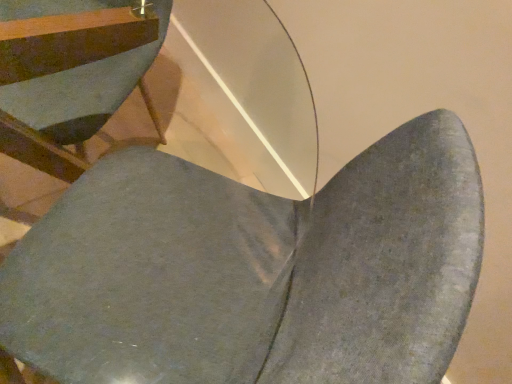
What do you see at coordinates (254, 271) in the screenshot?
I see `matte gray chair at center, which is the first chair in right-to-left order` at bounding box center [254, 271].

What is the approximate width of matte gray chair at center, which is the first chair in right-to-left order?

The width of matte gray chair at center, which is the first chair in right-to-left order, is 22.30 inches.

Find the location of a particular element. This screenshot has width=512, height=384. matte gray chair at center, marked as the second chair in a left-to-right arrangement is located at coordinates (254, 271).

Image resolution: width=512 pixels, height=384 pixels. Describe the element at coordinates (72, 76) in the screenshot. I see `matte gray chair at lower left, the first chair positioned from the left` at that location.

Locate an element on the screen. This screenshot has height=384, width=512. matte gray chair at lower left, arranged as the second chair when viewed from the right is located at coordinates (72, 76).

This screenshot has height=384, width=512. Identify the location of matte gray chair at center, marked as the second chair in a left-to-right arrangement. (254, 271).

Between matte gray chair at lower left, arranged as the second chair when viewed from the right, and matte gray chair at center, marked as the second chair in a left-to-right arrangement, which one appears on the right side from the viewer's perspective?

From the viewer's perspective, matte gray chair at center, marked as the second chair in a left-to-right arrangement, appears more on the right side.

Is matte gray chair at lower left, the first chair positioned from the left, closer to camera compared to matte gray chair at center, which is the first chair in right-to-left order?

No, it is behind matte gray chair at center, which is the first chair in right-to-left order.

Does point (4, 139) come behind point (411, 226)?

That is True.

From the image's perspective, is matte gray chair at lower left, the first chair positioned from the left, located above matte gray chair at center, marked as the second chair in a left-to-right arrangement?

Yes, from the image's perspective, matte gray chair at lower left, the first chair positioned from the left, is over matte gray chair at center, marked as the second chair in a left-to-right arrangement.

From a real-world perspective, which is physically above, matte gray chair at lower left, arranged as the second chair when viewed from the right, or matte gray chair at center, marked as the second chair in a left-to-right arrangement?

matte gray chair at center, marked as the second chair in a left-to-right arrangement, from a real-world perspective.

Considering the relative sizes of matte gray chair at lower left, arranged as the second chair when viewed from the right, and matte gray chair at center, marked as the second chair in a left-to-right arrangement, in the image provided, is matte gray chair at lower left, arranged as the second chair when viewed from the right, thinner than matte gray chair at center, marked as the second chair in a left-to-right arrangement,?

In fact, matte gray chair at lower left, arranged as the second chair when viewed from the right, might be wider than matte gray chair at center, marked as the second chair in a left-to-right arrangement.

From their relative heights in the image, would you say matte gray chair at lower left, the first chair positioned from the left, is taller or shorter than matte gray chair at center, which is the first chair in right-to-left order?

In the image, matte gray chair at lower left, the first chair positioned from the left, appears to be shorter than matte gray chair at center, which is the first chair in right-to-left order.

Between matte gray chair at lower left, arranged as the second chair when viewed from the right, and matte gray chair at center, marked as the second chair in a left-to-right arrangement, which one has larger size?

matte gray chair at center, marked as the second chair in a left-to-right arrangement.

Is matte gray chair at lower left, arranged as the second chair when viewed from the right, positioned beyond the bounds of matte gray chair at center, which is the first chair in right-to-left order?

That's correct, matte gray chair at lower left, arranged as the second chair when viewed from the right, is outside of matte gray chair at center, which is the first chair in right-to-left order.

Is matte gray chair at lower left, the first chair positioned from the left, next to matte gray chair at center, marked as the second chair in a left-to-right arrangement?

No, matte gray chair at lower left, the first chair positioned from the left, is not in contact with matte gray chair at center, marked as the second chair in a left-to-right arrangement.

Is matte gray chair at center, marked as the second chair in a left-to-right arrangement, at the back of matte gray chair at lower left, arranged as the second chair when viewed from the right?

No.

The image size is (512, 384). I want to click on chair below the matte gray chair at center, marked as the second chair in a left-to-right arrangement (from a real-world perspective), so click(72, 76).

Is matte gray chair at center, marked as the second chair in a left-to-right arrangement, at the left side of matte gray chair at lower left, the first chair positioned from the left?

Incorrect, matte gray chair at center, marked as the second chair in a left-to-right arrangement, is not on the left side of matte gray chair at lower left, the first chair positioned from the left.

Is the position of matte gray chair at center, marked as the second chair in a left-to-right arrangement, less distant than that of matte gray chair at lower left, the first chair positioned from the left?

That is True.

Between point (180, 161) and point (151, 102), which one is positioned in front?

The point (180, 161) is closer.

From the image's perspective, is matte gray chair at center, marked as the second chair in a left-to-right arrangement, located above or below matte gray chair at lower left, arranged as the second chair when viewed from the right?

From the image's perspective, matte gray chair at center, marked as the second chair in a left-to-right arrangement, appears below matte gray chair at lower left, arranged as the second chair when viewed from the right.

In the scene shown: From a real-world perspective, who is located lower, matte gray chair at center, which is the first chair in right-to-left order, or matte gray chair at lower left, arranged as the second chair when viewed from the right?

Result: matte gray chair at lower left, arranged as the second chair when viewed from the right.

Can you confirm if matte gray chair at center, marked as the second chair in a left-to-right arrangement, is wider than matte gray chair at lower left, arranged as the second chair when viewed from the right?

Incorrect, the width of matte gray chair at center, marked as the second chair in a left-to-right arrangement, does not surpass that of matte gray chair at lower left, arranged as the second chair when viewed from the right.

Consider the image. From their relative heights in the image, would you say matte gray chair at center, which is the first chair in right-to-left order, is taller or shorter than matte gray chair at lower left, the first chair positioned from the left?

matte gray chair at center, which is the first chair in right-to-left order, is taller than matte gray chair at lower left, the first chair positioned from the left.

Between matte gray chair at center, which is the first chair in right-to-left order, and matte gray chair at lower left, the first chair positioned from the left, which one has smaller size?

matte gray chair at lower left, the first chair positioned from the left, is smaller.

Is matte gray chair at lower left, the first chair positioned from the left, inside matte gray chair at center, marked as the second chair in a left-to-right arrangement?

No, matte gray chair at lower left, the first chair positioned from the left, is located outside of matte gray chair at center, marked as the second chair in a left-to-right arrangement.

Is matte gray chair at center, marked as the second chair in a left-to-right arrangement, with matte gray chair at lower left, arranged as the second chair when viewed from the right?

No, matte gray chair at center, marked as the second chair in a left-to-right arrangement, is not making contact with matte gray chair at lower left, arranged as the second chair when viewed from the right.

Is matte gray chair at center, marked as the second chair in a left-to-right arrangement, looking in the opposite direction of matte gray chair at lower left, the first chair positioned from the left?

No.

Can you tell me how much matte gray chair at center, marked as the second chair in a left-to-right arrangement, and matte gray chair at lower left, the first chair positioned from the left, differ in facing direction?

92.8 degrees separate the facing orientations of matte gray chair at center, marked as the second chair in a left-to-right arrangement, and matte gray chair at lower left, the first chair positioned from the left.

How far apart are matte gray chair at center, which is the first chair in right-to-left order, and matte gray chair at lower left, arranged as the second chair when viewed from the right?

matte gray chair at center, which is the first chair in right-to-left order, and matte gray chair at lower left, arranged as the second chair when viewed from the right, are 12.73 inches apart.

Where is `chair above the matte gray chair at center, which is the first chair in right-to-left order (from the image's perspective)`? The width and height of the screenshot is (512, 384). chair above the matte gray chair at center, which is the first chair in right-to-left order (from the image's perspective) is located at coordinates (72, 76).

Locate an element on the screen. This screenshot has height=384, width=512. chair below the matte gray chair at lower left, the first chair positioned from the left (from the image's perspective) is located at coordinates coord(254,271).

The height and width of the screenshot is (384, 512). What are the coordinates of `chair beneath the matte gray chair at center, marked as the second chair in a left-to-right arrangement (from a real-world perspective)` in the screenshot? It's located at (72, 76).